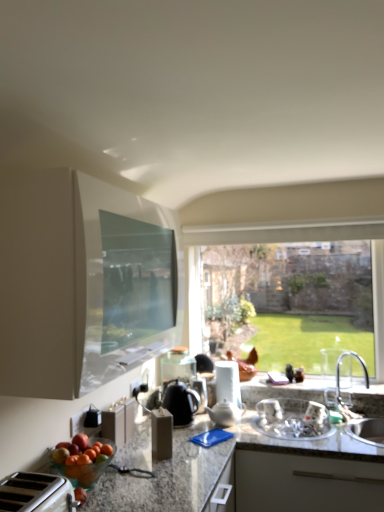
Question: From a real-world perspective, is clear glass window at center positioned above or below white ceramic sink at right, arranged as the 1th sink when viewed from the right?

Choices:
 (A) below
 (B) above

Answer: (B)

Question: Considering the positions of clear glass window at center and white ceramic sink at right, placed as the second sink when sorted from left to right, in the image, is clear glass window at center taller or shorter than white ceramic sink at right, placed as the second sink when sorted from left to right,?

Choices:
 (A) tall
 (B) short

Answer: (A)

Question: Which object is the closest to the granite countertop at lower left?

Choices:
 (A) white ceramic sink at right, placed as the second sink when sorted from left to right
 (B) clear glass window at center
 (C) white ceramic teapot at center, which is the first tea pot from right to left
 (D) black glossy tea pot at center, which ranks as the 1th tea pot in left-to-right order
 (E) white glossy kettle at center, positioned as the second appliance in right-to-left order

Answer: (D)

Question: Estimate the real-world distances between objects in this image. Which object is farther from the white plastic toaster at lower left, the first appliance when ordered from left to right?

Choices:
 (A) black glossy tea pot at center, which ranks as the 2th tea pot in right-to-left order
 (B) granite countertop at lower left
 (C) white ceramic sink at right, placed as the second sink when sorted from left to right
 (D) white glossy sink at lower center, the 1th sink in the left-to-right sequence
 (E) matte white toaster at lower center, acting as the first cabinetry starting from the bottom

Answer: (C)